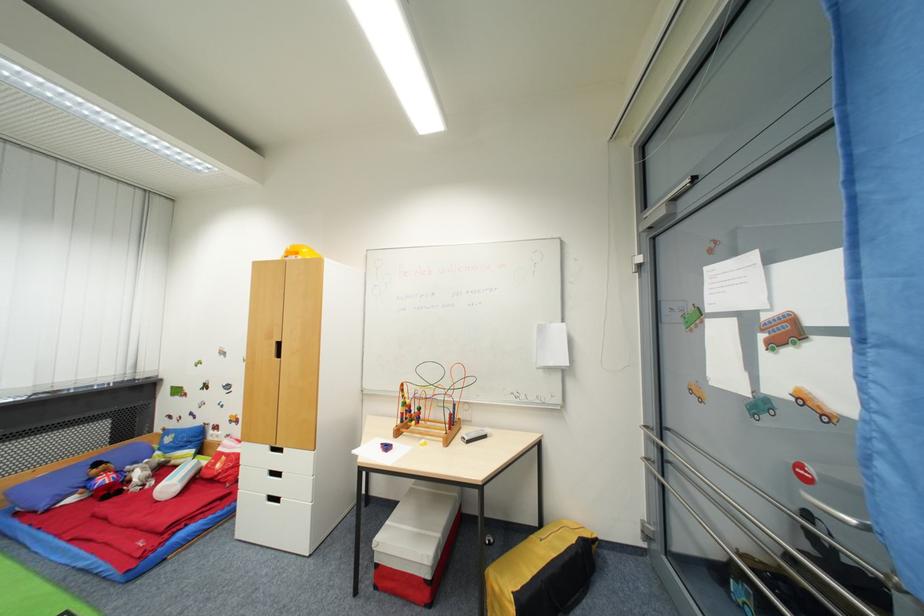
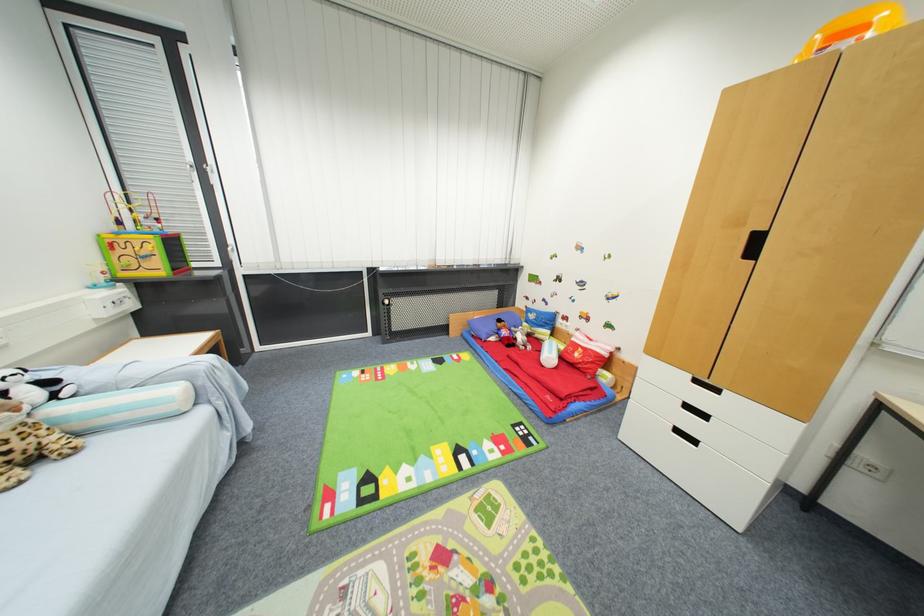
Where in the second image is the point corresponding to the point at 301,254 from the first image?

(868, 30)